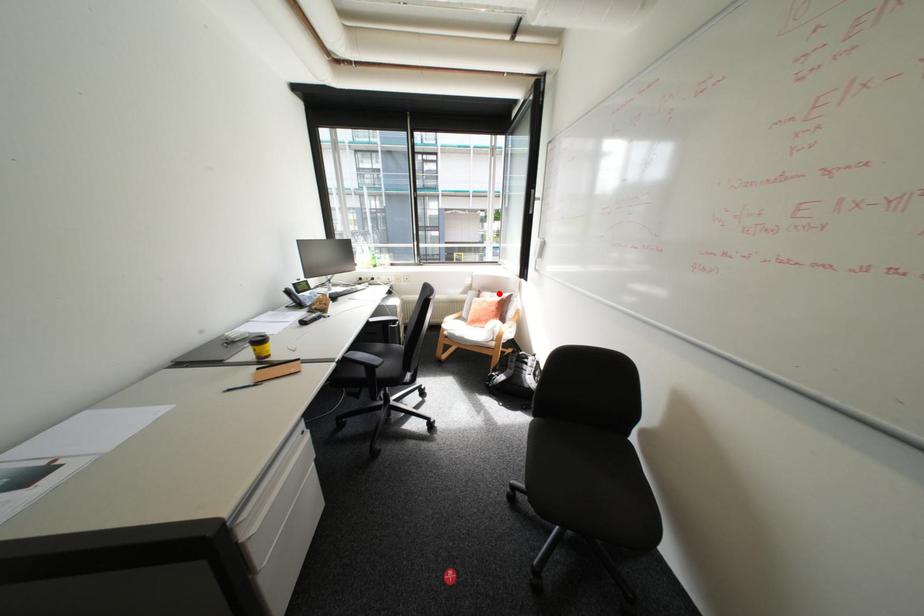
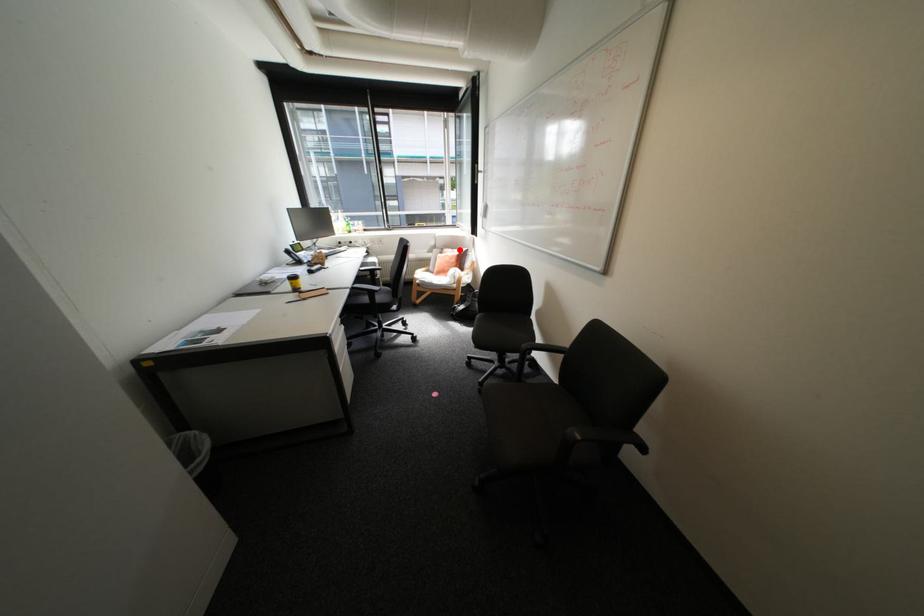
I am providing you with two images of the same scene from different viewpoints. A red point is marked on the first image and another point is marked on the second image. Do the highlighted points in image1 and image2 indicate the same real-world spot?

Yes